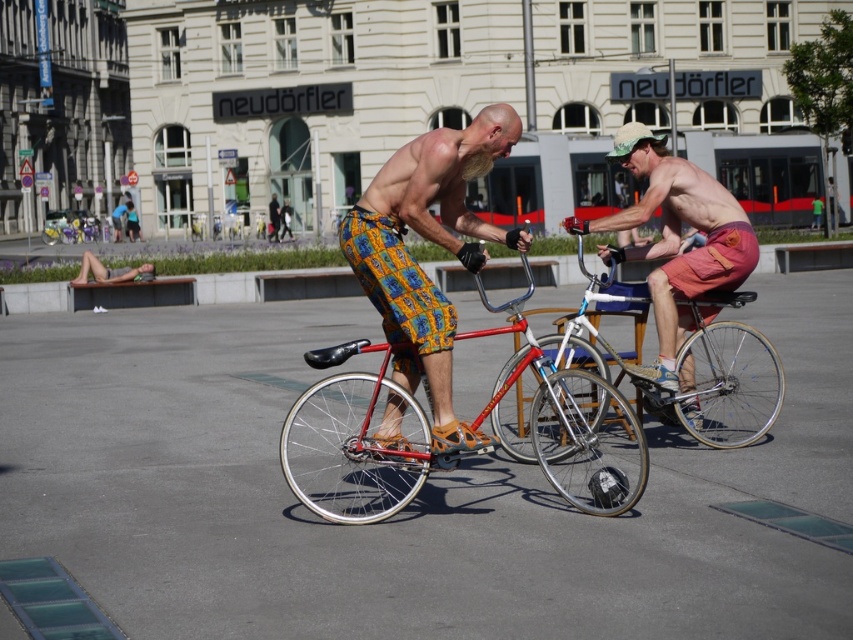
Question: Considering the relative positions of yellow patterned shorts at center and shiny silver bicycle at center in the image provided, where is yellow patterned shorts at center located with respect to shiny silver bicycle at center?

Choices:
 (A) right
 (B) left

Answer: (B)

Question: Which point appears farthest from the camera in this image?

Choices:
 (A) (573, 396)
 (B) (465, 177)

Answer: (A)

Question: Which object appears closest to the camera in this image?

Choices:
 (A) shiny silver bicycle at center
 (B) shiny metallic bicycle at center
 (C) yellow patterned shorts at center

Answer: (B)

Question: Where is shiny metallic bicycle at center located in relation to yellow patterned shorts at center in the image?

Choices:
 (A) above
 (B) below

Answer: (B)

Question: Is shiny metallic bicycle at center thinner than yellow patterned shorts at center?

Choices:
 (A) no
 (B) yes

Answer: (A)

Question: Among these objects, which one is nearest to the camera?

Choices:
 (A) yellow patterned shorts at center
 (B) shiny silver bicycle at center

Answer: (A)